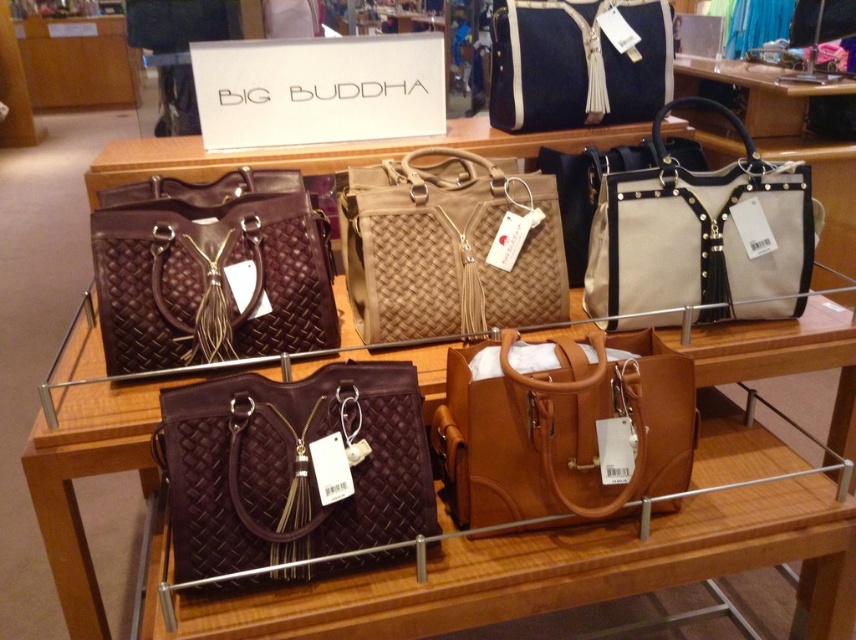
You are a customer in the store and want to find the tan leather handbag at center. Based on its coordinates, where should you look on the shelves?

The tan leather handbag at center is located at coordinates point (563, 428), which means it is positioned on the lower part of the shelves.

You are a customer in a store and want to pick up the tan leather handbag at center and the beige canvas tote at upper right. Which one can you reach without moving your current position?

The tan leather handbag at center is closer to the viewer than the beige canvas tote at upper right, so you can reach the tan leather handbag at center without moving.